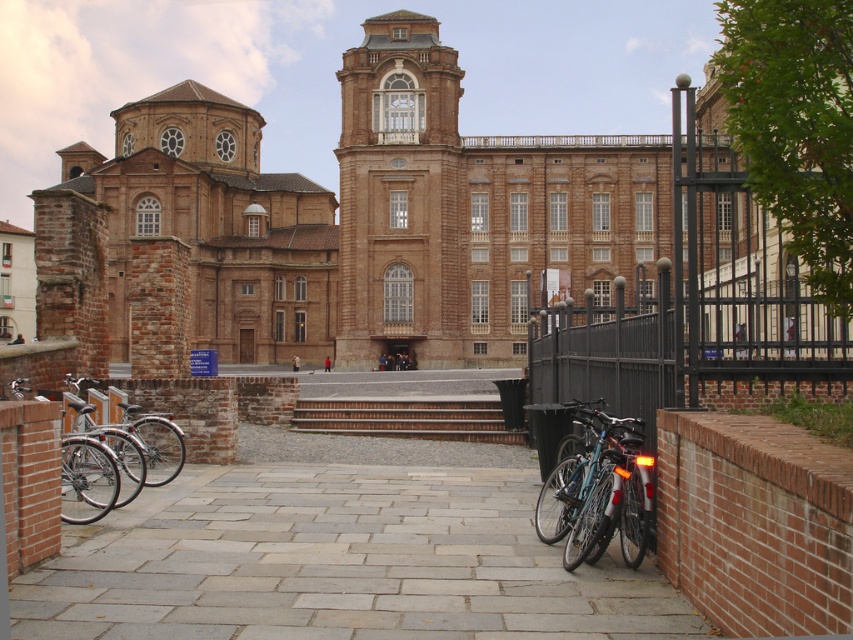
Question: Is brown stone church at center bigger than shiny blue bike at lower right?

Choices:
 (A) yes
 (B) no

Answer: (A)

Question: Which object appears closest to the camera in this image?

Choices:
 (A) brown stone church at center
 (B) brick/stone stairs at center
 (C) silver metallic bicycle at lower left
 (D) shiny blue bike at lower right

Answer: (D)

Question: Is brown stone church at center to the right of silver metallic bicycle at lower left from the viewer's perspective?

Choices:
 (A) yes
 (B) no

Answer: (A)

Question: Which of the following is the farthest from the observer?

Choices:
 (A) silver metallic bicycle at lower left
 (B) brown stone church at center
 (C) shiny blue bike at lower right
 (D) brick/stone stairs at center

Answer: (D)

Question: Which is nearer to the shiny blue bike at lower right?

Choices:
 (A) brick/stone stairs at center
 (B) brown stone church at center

Answer: (A)

Question: Can you confirm if brown stone church at center is thinner than shiny blue bike at lower right?

Choices:
 (A) yes
 (B) no

Answer: (B)